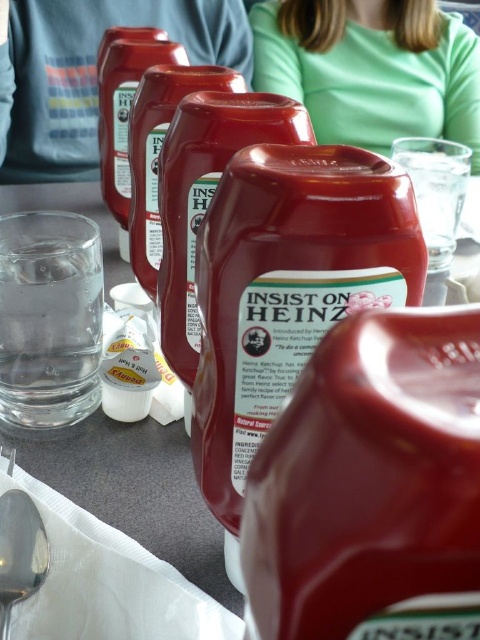
Image resolution: width=480 pixels, height=640 pixels. What do you see at coordinates (363, 81) in the screenshot?
I see `green matte shirt at upper center` at bounding box center [363, 81].

Which is below, green matte shirt at upper center or satin silver spoon at lower left?

Positioned lower is satin silver spoon at lower left.

Is point (451, 33) positioned after point (12, 563)?

Yes, point (451, 33) is behind point (12, 563).

Locate an element on the screen. green matte shirt at upper center is located at coordinates (363, 81).

From the picture: Who is positioned more to the left, matte plastic cup at upper center or satin silver spoon at lower left?

matte plastic cup at upper center is more to the left.

Who is more distant from viewer, (4, 99) or (32, 579)?

The point (4, 99) is behind.

What are the coordinates of `matte plastic cup at upper center` in the screenshot? It's located at (88, 74).

Is matte plastic cup at upper center to the left of green matte shirt at upper center from the viewer's perspective?

Yes, matte plastic cup at upper center is to the left of green matte shirt at upper center.

Is matte plastic cup at upper center smaller than green matte shirt at upper center?

Incorrect, matte plastic cup at upper center is not smaller in size than green matte shirt at upper center.

The width and height of the screenshot is (480, 640). Find the location of `matte plastic cup at upper center`. matte plastic cup at upper center is located at coordinates (88, 74).